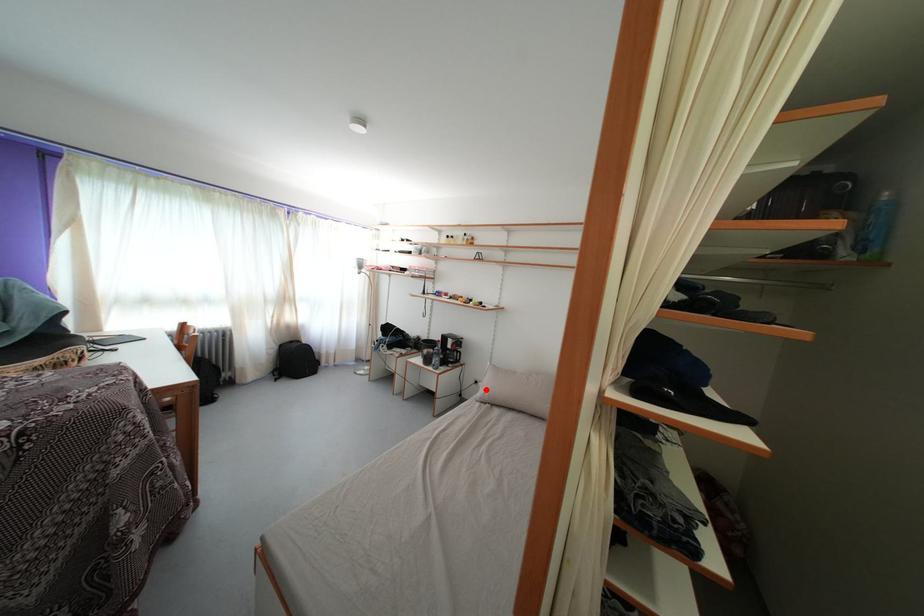
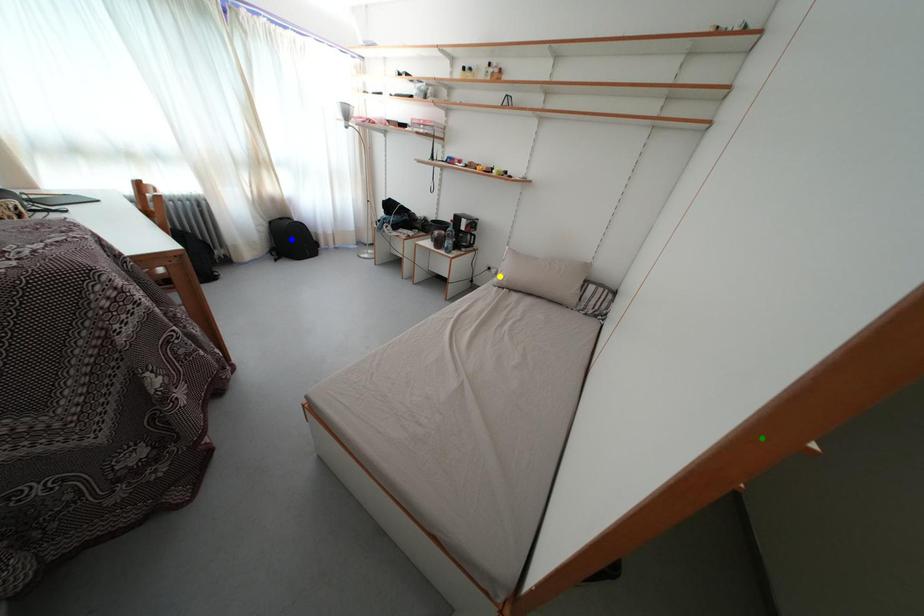
Question: I am providing you with two images of the same scene from different viewpoints. A red point is marked on the first image. You are given multiple points on the second image. Which spot in image 2 lines up with the point in image 1?

Choices:
 (A) green point
 (B) blue point
 (C) yellow point

Answer: (C)